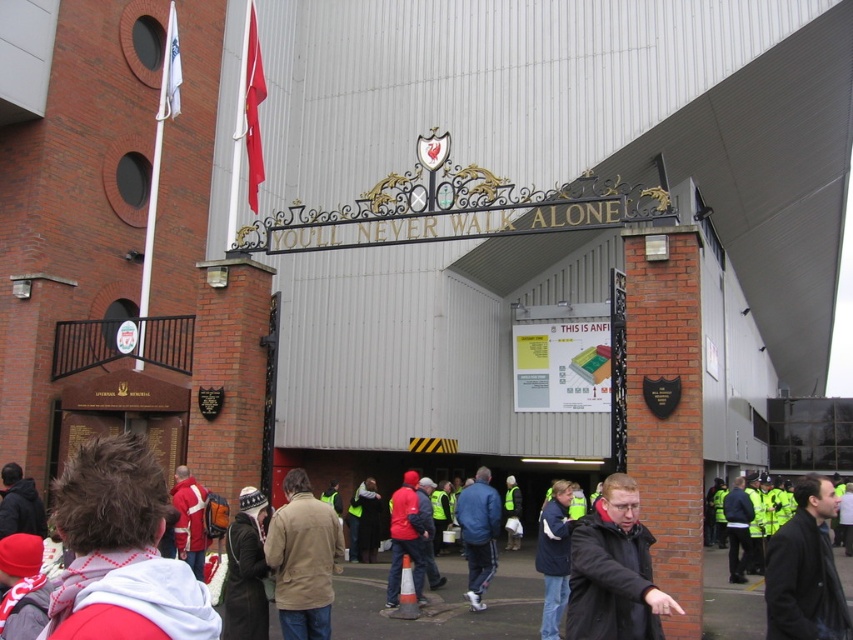
Can you confirm if beige fabric jacket at center is taller than dark blue jacket at center?

Incorrect, beige fabric jacket at center's height is not larger of dark blue jacket at center's.

Measure the distance between point (271, 525) and camera.

Point (271, 525) and camera are 30.32 meters apart.

Describe the element at coordinates (303, 557) in the screenshot. I see `beige fabric jacket at center` at that location.

I want to click on beige fabric jacket at center, so click(x=303, y=557).

Which is more to the right, dark brown leather jacket at center or red matte jacket at center?

dark brown leather jacket at center

Where is `dark brown leather jacket at center`? dark brown leather jacket at center is located at coordinates (805, 570).

The width and height of the screenshot is (853, 640). Identify the location of dark brown leather jacket at center. (805, 570).

Who is shorter, dark brown leather jacket at lower left or red knit cap at upper left?

dark brown leather jacket at lower left

Between dark brown leather jacket at lower left and red knit cap at upper left, which one has more height?

red knit cap at upper left

Find the location of a particular element. This screenshot has width=853, height=640. dark brown leather jacket at lower left is located at coordinates (247, 570).